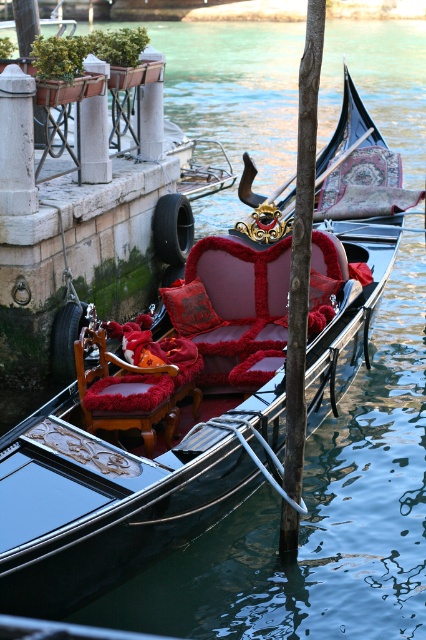
Question: Is the position of velvet red daybed at center less distant than that of silky red cushion at center?

Choices:
 (A) no
 (B) yes

Answer: (B)

Question: Estimate the real-world distances between objects in this image. Which object is closer to the velvet red chair at center?

Choices:
 (A) velvet red daybed at center
 (B) silky red cushion at center

Answer: (A)

Question: Estimate the real-world distances between objects in this image. Which object is closer to the velvet red daybed at center?

Choices:
 (A) velvet red chair at center
 (B) smooth brown wood pole at center
 (C) silky red cushion at center

Answer: (C)

Question: Is velvet red chair at center bigger than silky red cushion at center?

Choices:
 (A) no
 (B) yes

Answer: (B)

Question: Estimate the real-world distances between objects in this image. Which object is closer to the silky red cushion at center?

Choices:
 (A) smooth brown wood pole at center
 (B) velvet red chair at center
 (C) velvet red daybed at center

Answer: (C)

Question: Does velvet red daybed at center have a lesser width compared to smooth brown wood pole at center?

Choices:
 (A) no
 (B) yes

Answer: (A)